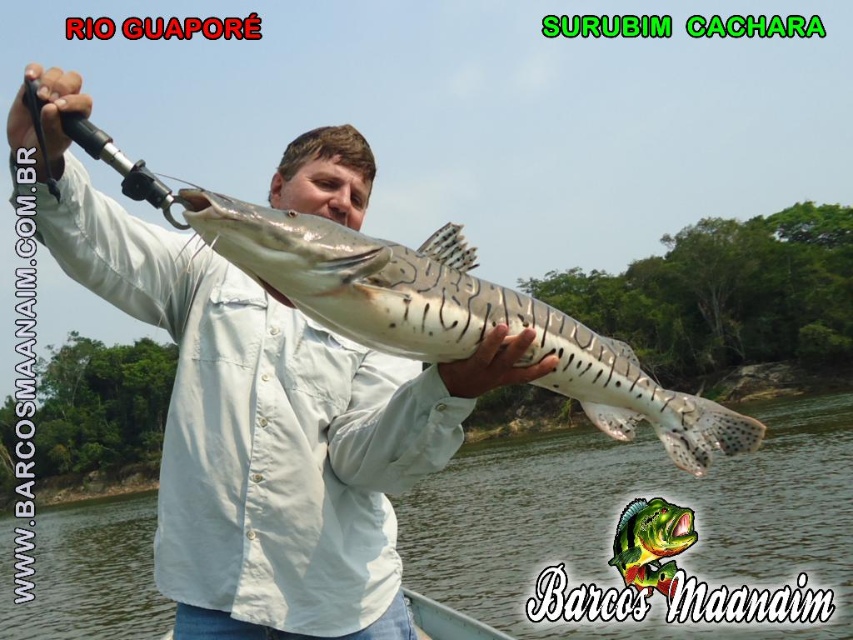
Question: Which point is farther to the camera?

Choices:
 (A) (115, 228)
 (B) (328, 301)

Answer: (A)

Question: Which point appears closest to the camera in this image?

Choices:
 (A) (294, 292)
 (B) (21, 150)

Answer: (A)

Question: Observing the image, what is the correct spatial positioning of white matte shirt at center in reference to speckled skin fish at center?

Choices:
 (A) right
 (B) left

Answer: (B)

Question: Is white matte shirt at center above speckled skin fish at center?

Choices:
 (A) yes
 (B) no

Answer: (A)

Question: Which object appears closest to the camera in this image?

Choices:
 (A) speckled skin fish at center
 (B) white matte shirt at center

Answer: (A)

Question: Is white matte shirt at center in front of speckled skin fish at center?

Choices:
 (A) no
 (B) yes

Answer: (A)